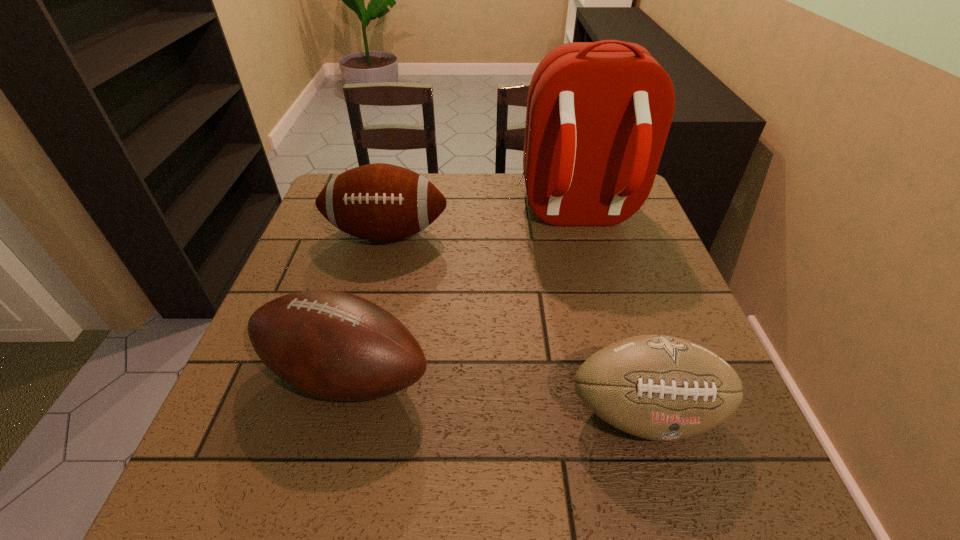
Find the location of a particular element. The width and height of the screenshot is (960, 540). empty space between the backpack and the farthest football (American) is located at coordinates (481, 225).

This screenshot has height=540, width=960. I want to click on blank region between the backpack and the farthest football (American), so click(481, 225).

Where is `free space between the farthest football (American) and the rightmost football (American)`? This screenshot has width=960, height=540. free space between the farthest football (American) and the rightmost football (American) is located at coordinates (516, 323).

I want to click on free space between the rightmost football (American) and the backpack, so click(x=611, y=314).

Where is `vacant point located between the farthest football (American) and the backpack`? vacant point located between the farthest football (American) and the backpack is located at coordinates (481, 225).

The width and height of the screenshot is (960, 540). I want to click on object that can be found as the second closest to the rightmost football (American), so click(598, 114).

Image resolution: width=960 pixels, height=540 pixels. Identify the location of the third closest object relative to the farthest football (American). (657, 387).

Choose which football (American) is the nearest neighbor to the farthest football (American). Please provide its 2D coordinates. Your answer should be formatted as a tuple, i.e. [(x, y)], where the tuple contains the x and y coordinates of a point satisfying the conditions above.

[(334, 345)]

Point out which football (American) is positioned as the second nearest to the farthest football (American). Please provide its 2D coordinates. Your answer should be formatted as a tuple, i.e. [(x, y)], where the tuple contains the x and y coordinates of a point satisfying the conditions above.

[(657, 387)]